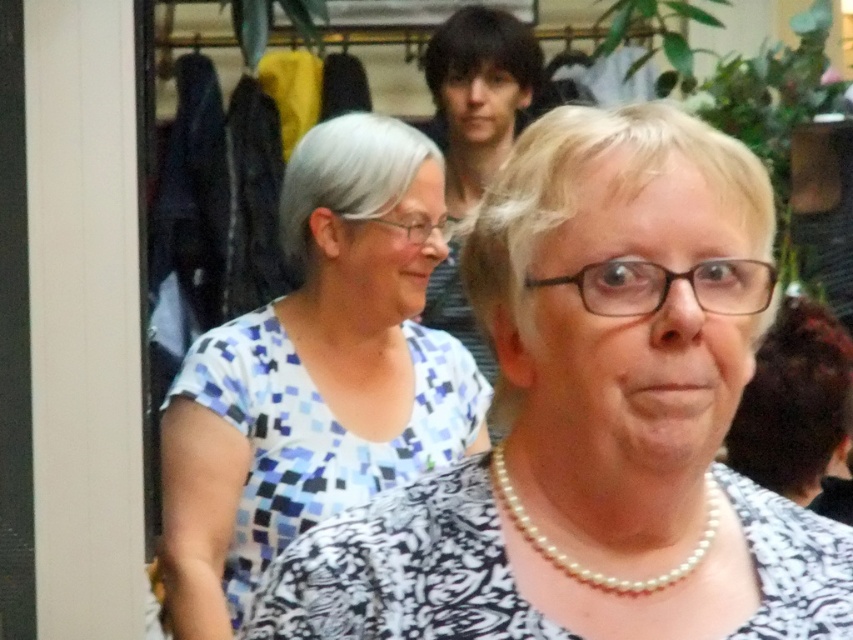
Does blue mosaic shirt at center have a greater height compared to pearl necklace at center?

Yes, blue mosaic shirt at center is taller than pearl necklace at center.

Between point (367, 374) and point (695, 556), which one is positioned in front?

Point (695, 556) is in front.

Where is `blue mosaic shirt at center`? This screenshot has width=853, height=640. blue mosaic shirt at center is located at coordinates (315, 372).

Does white printed blouse at center come in front of pearl necklace at center?

That is True.

Does white printed blouse at center appear over pearl necklace at center?

No.

You are a GUI agent. You are given a task and a screenshot of the screen. Output one action in this format:
    pyautogui.click(x=<x>, y=<y>)
    Task: Click on the white printed blouse at center
    
    Given the screenshot: What is the action you would take?
    pyautogui.click(x=592, y=420)

Where is `white printed blouse at center`? white printed blouse at center is located at coordinates (592, 420).

Is white printed blouse at center closer to camera compared to blue mosaic shirt at center?

Yes, white printed blouse at center is in front of blue mosaic shirt at center.

Describe the element at coordinates (592, 420) in the screenshot. I see `white printed blouse at center` at that location.

Is point (572, 291) less distant than point (225, 369)?

Yes, point (572, 291) is closer to viewer.

Locate an element on the screen. white printed blouse at center is located at coordinates (592, 420).